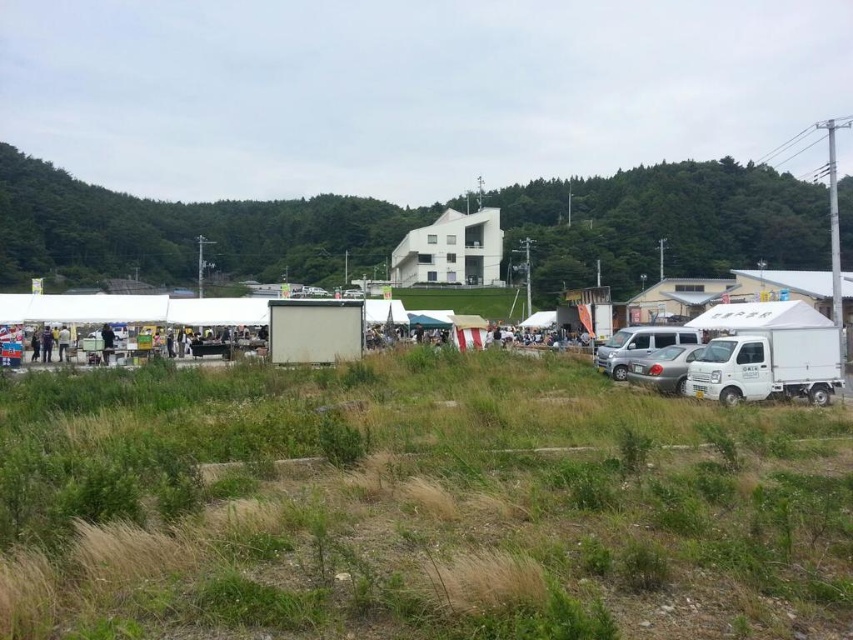
Question: Which object appears farthest from the camera in this image?

Choices:
 (A) white matte truck at right
 (B) dark blue shirt at left

Answer: (B)

Question: Which object is the farthest from the green grass at lower center?

Choices:
 (A) silver metallic van at right
 (B) white fabric tent at lower left

Answer: (B)

Question: Considering the real-world distances, which object is closest to the white fabric tent at lower left?

Choices:
 (A) dark gray fabric jacket at lower left
 (B) white matte truck at right
 (C) dark blue shirt at lower left

Answer: (C)

Question: Does green grass at lower center lie behind white matte truck at right?

Choices:
 (A) no
 (B) yes

Answer: (A)

Question: Does silver metallic van at right appear on the left side of dark blue shirt at lower left?

Choices:
 (A) yes
 (B) no

Answer: (B)

Question: Can you confirm if silver metallic van at right is positioned to the right of white matte truck at lower right?

Choices:
 (A) yes
 (B) no

Answer: (A)